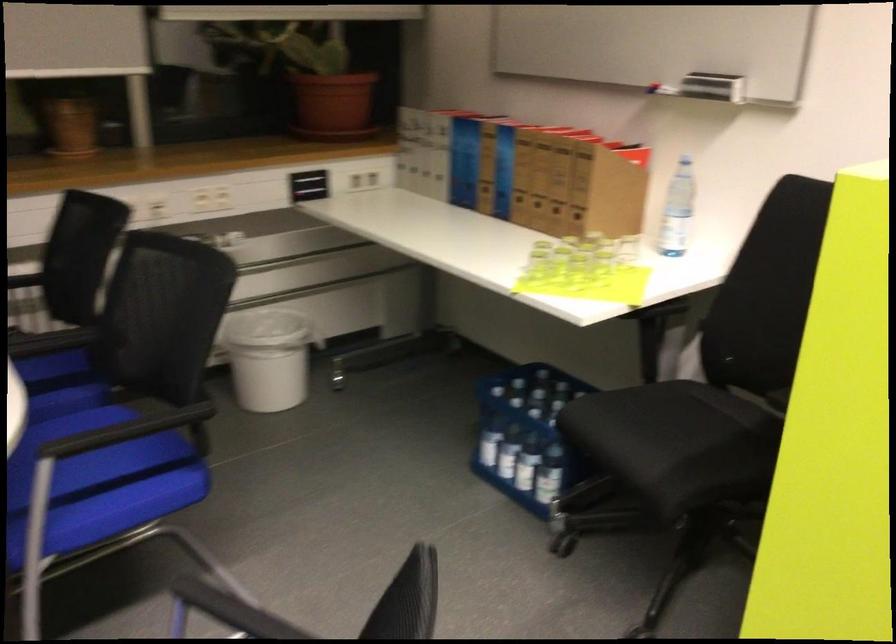
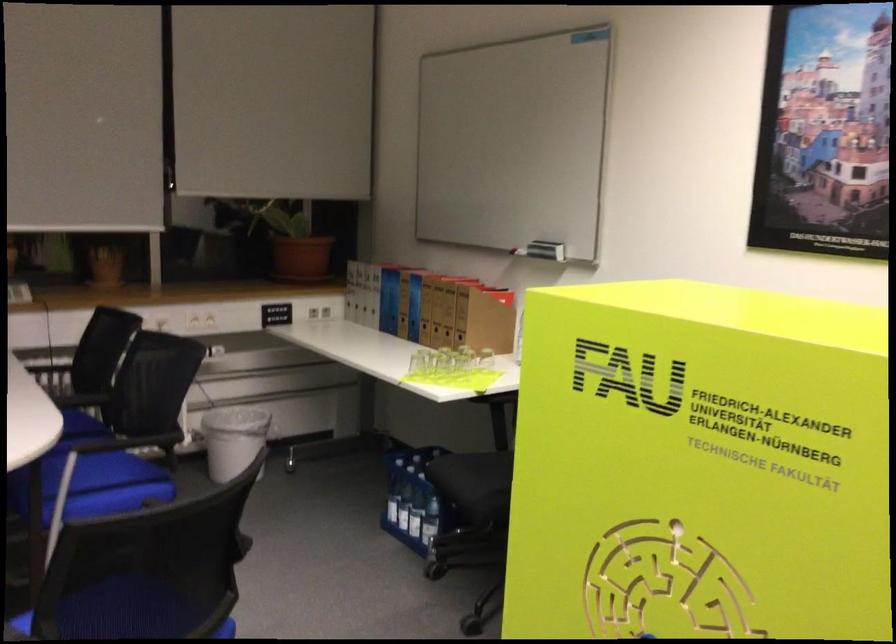
In the second image, find the point that corresponds to the point at 96,466 in the first image.

(95, 485)